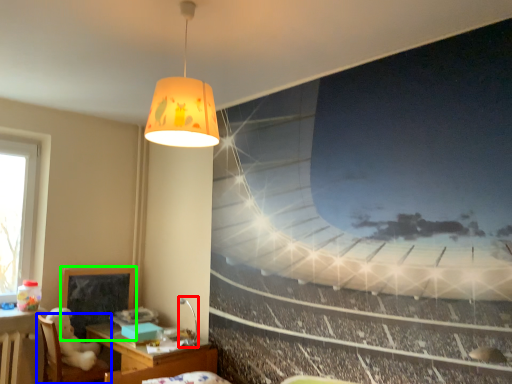
Question: Estimate the real-world distances between objects in this image. Which object is closer to lamp (highlighted by a red box), furniture (highlighted by a blue box) or bulletin board (highlighted by a green box)?

Choices:
 (A) furniture
 (B) bulletin board

Answer: (B)